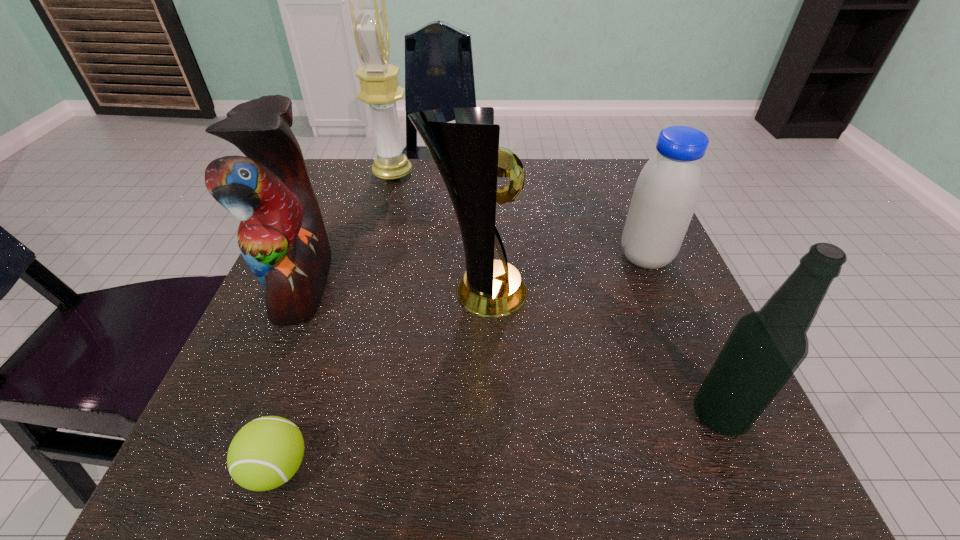
What are the coordinates of `vacant space at the far right corner` in the screenshot? It's located at (630, 191).

Where is `free space that is in between the tennis ball and the alcohol`? This screenshot has height=540, width=960. free space that is in between the tennis ball and the alcohol is located at coordinates (498, 442).

Identify the location of vacant region between the tennis ball and the nearer award. Image resolution: width=960 pixels, height=540 pixels. (377, 380).

Locate an element on the screen. free space between the right award and the left award is located at coordinates (435, 233).

This screenshot has width=960, height=540. Identify the location of free space between the farthest object and the fifth tallest object. (519, 215).

Identify the location of free space between the soya milk and the left award. The height and width of the screenshot is (540, 960). (519, 215).

Locate an element on the screen. Image resolution: width=960 pixels, height=540 pixels. free space between the alcohol and the parrot is located at coordinates (511, 349).

The height and width of the screenshot is (540, 960). What are the coordinates of `vacant region between the left award and the fourth object from left to right` in the screenshot? It's located at (435, 233).

I want to click on vacant area that lies between the parrot and the shortest object, so click(290, 375).

Image resolution: width=960 pixels, height=540 pixels. In order to click on empty space between the tennis ball and the alcohol in this screenshot , I will do (x=498, y=442).